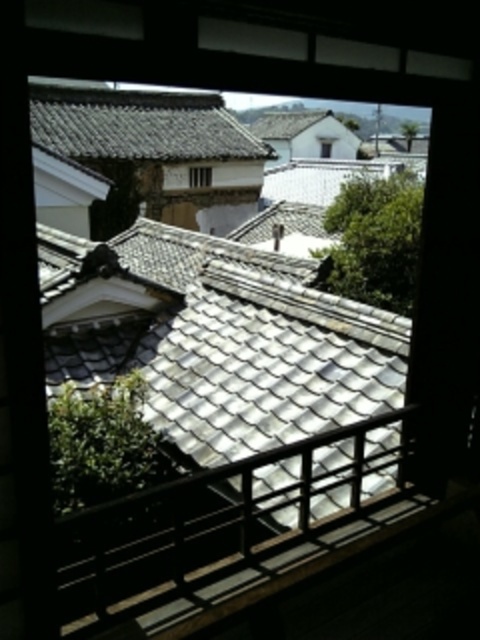
You are an architect designing a model of this scene. You need to ensure that the gray tile roof at upper center and the transparent glass window at center are proportionally accurate. Which object should be wider in your model?

The gray tile roof at upper center should be wider in the model since its width surpasses that of the transparent glass window at center according to the description.

You are an architect designing a model of this scene. You need to place a small decorative stone exactly at the midpoint between the white glazed tiles at center and the edge of the window frame. What coordinate should you use for the stone?

The midpoint between the white glazed tiles at center at point (216, 337) and the edge of the window frame would be calculated by averaging their coordinates. However, since the exact coordinate of the window frame edge isn

You are standing in a room and looking through the window. You want to know how far the gray tile roof at upper center is from your eyes. Can you determine the distance?

The gray tile roof at upper center is 22.15 meters away from the camera, so it is 22.15 meters away from your eyes.